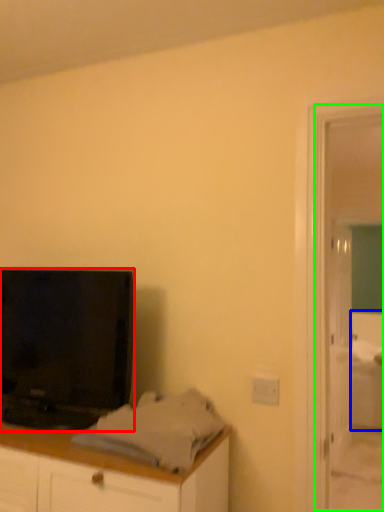
Question: Which is farther away from television (highlighted by a red box)? bed (highlighted by a blue box) or screen door (highlighted by a green box)?

Choices:
 (A) bed
 (B) screen door

Answer: (A)